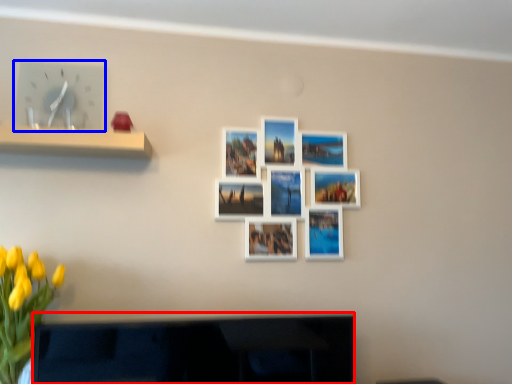
Question: Among these objects, which one is nearest to the camera, television (highlighted by a red box) or clock (highlighted by a blue box)?

Choices:
 (A) television
 (B) clock

Answer: (A)